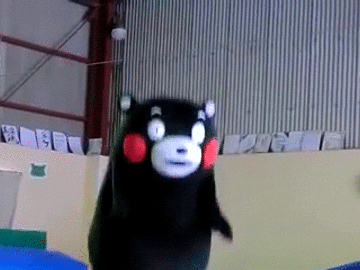
What are the coordinates of `picture frame on the left` in the screenshot? It's located at click(x=9, y=134).